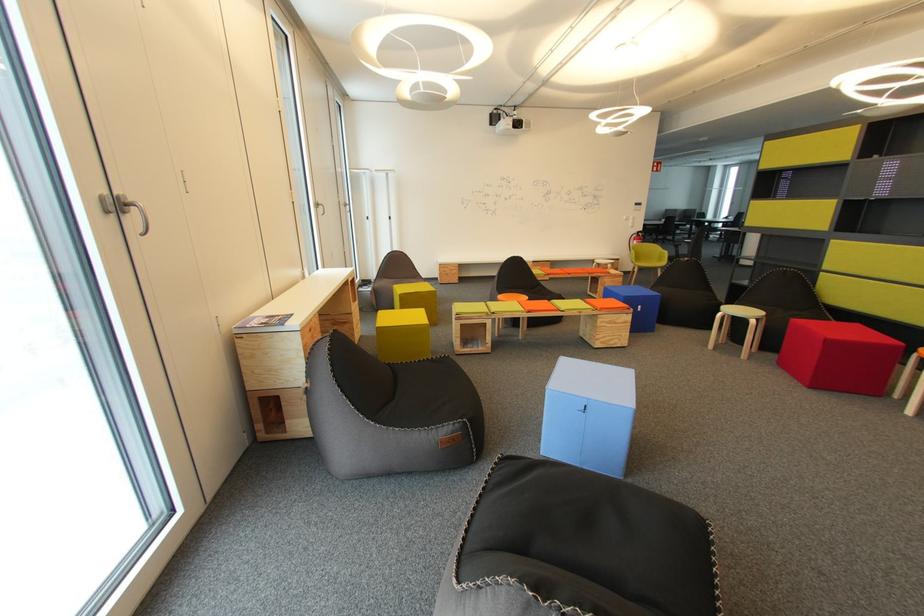
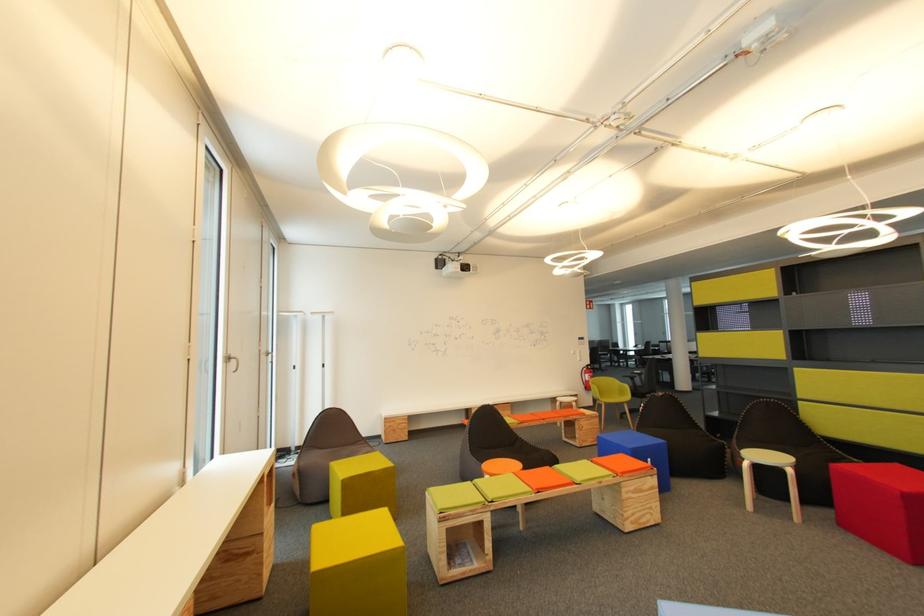
What movement of the cameraman would produce the second image?

The cameraman walked toward left, forward.